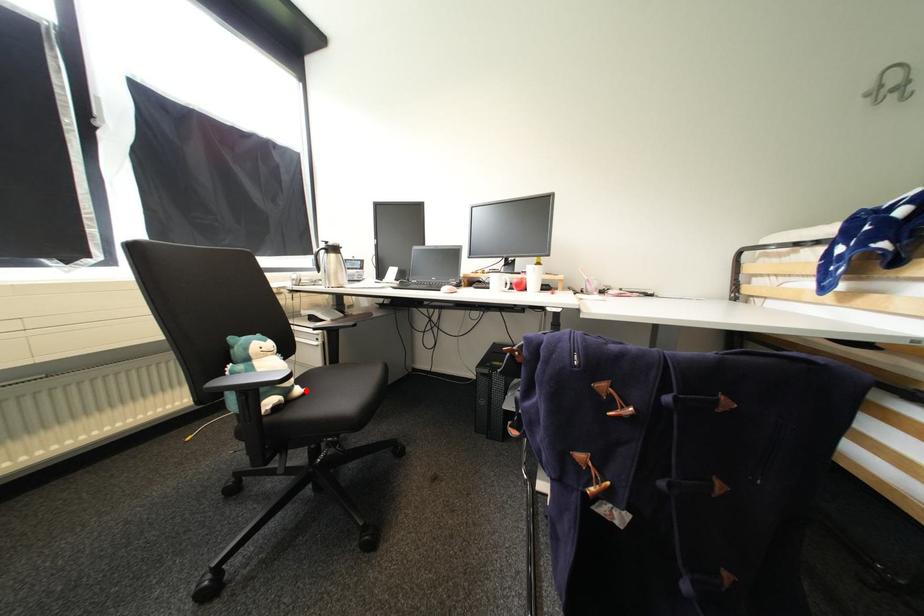
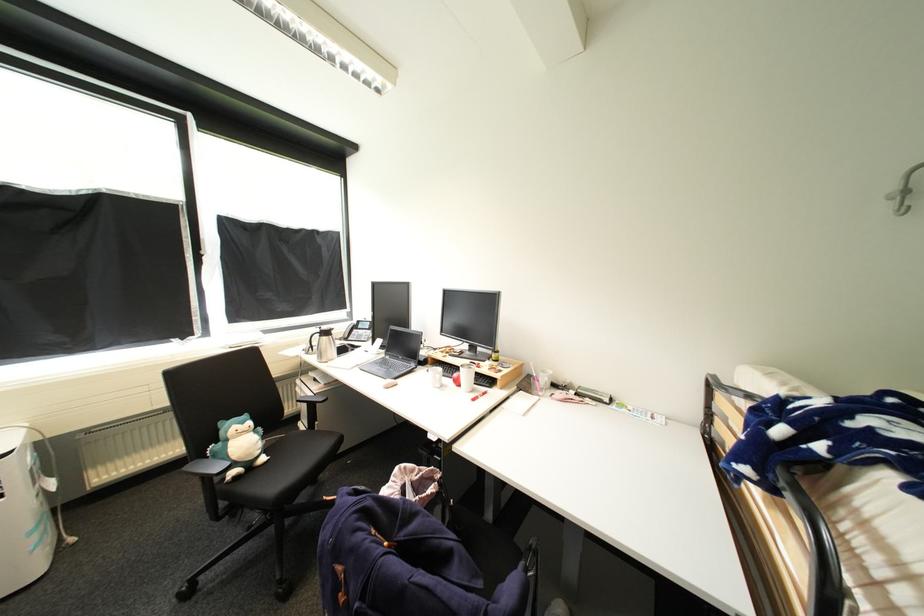
Question: I am providing you with two images of the same scene from different viewpoints. Image1 has a red point marked. In image2, the corresponding 3D location appears at what relative position? Reply with the corresponding letter.

Choices:
 (A) Closer
 (B) Farther

Answer: (A)